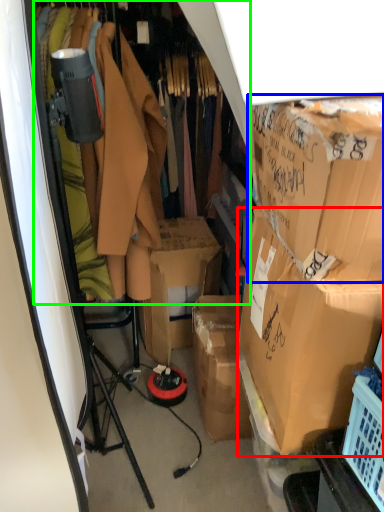
Question: Which object is the farthest from box (highlighted by a red box)? Choose among these: box (highlighted by a blue box) or closet (highlighted by a green box).

Choices:
 (A) box
 (B) closet

Answer: (B)